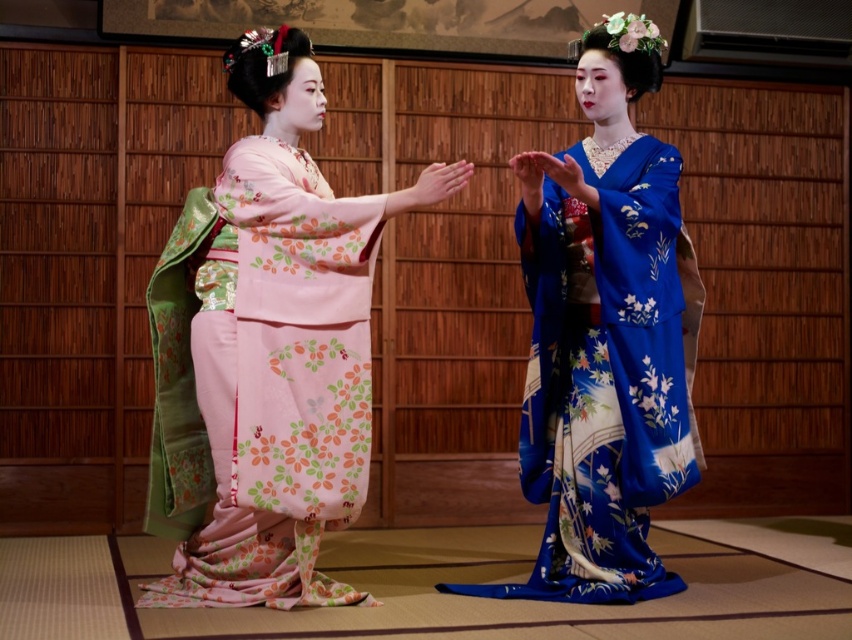
Question: From the image, what is the correct spatial relationship of pink floral kimono at center in relation to blue silk kimono at center?

Choices:
 (A) left
 (B) right

Answer: (A)

Question: Among these objects, which one is farthest from the camera?

Choices:
 (A) blue silk kimono at center
 (B) pink floral kimono at center

Answer: (A)

Question: Which object is farther from the camera taking this photo?

Choices:
 (A) blue silk kimono at center
 (B) pink floral kimono at center

Answer: (A)

Question: Is pink floral kimono at center in front of blue silk kimono at center?

Choices:
 (A) no
 (B) yes

Answer: (B)

Question: Is pink floral kimono at center wider than blue silk kimono at center?

Choices:
 (A) yes
 (B) no

Answer: (A)

Question: Which point is farther to the camera?

Choices:
 (A) blue silk kimono at center
 (B) pink floral kimono at center

Answer: (A)